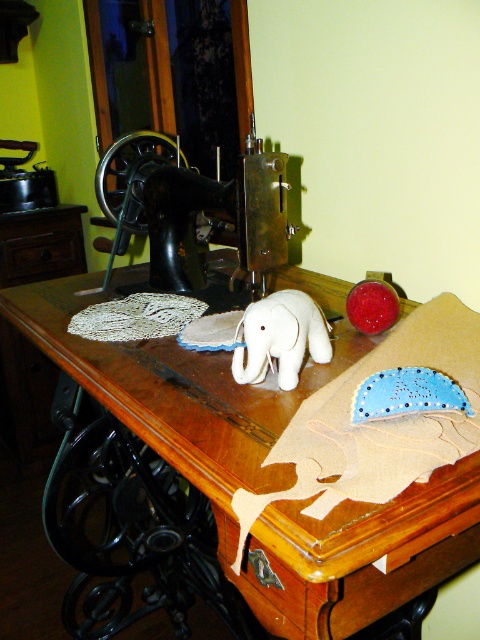
Question: Among these points, which one is farthest from the camera?

Choices:
 (A) (403, 596)
 (B) (232, 202)

Answer: (B)

Question: In this image, where is wooden sewing machine at center located relative to black metal sewing machine at center?

Choices:
 (A) right
 (B) left

Answer: (A)

Question: Which object appears closest to the camera in this image?

Choices:
 (A) wooden sewing machine at center
 (B) black metal sewing machine at center
 (C) white plush elephant at center

Answer: (A)

Question: Does black metal sewing machine at center have a greater width compared to white plush elephant at center?

Choices:
 (A) yes
 (B) no

Answer: (A)

Question: Does wooden sewing machine at center appear on the right side of white plush elephant at center?

Choices:
 (A) yes
 (B) no

Answer: (B)

Question: Which object appears closest to the camera in this image?

Choices:
 (A) black metal sewing machine at center
 (B) wooden sewing machine at center

Answer: (B)